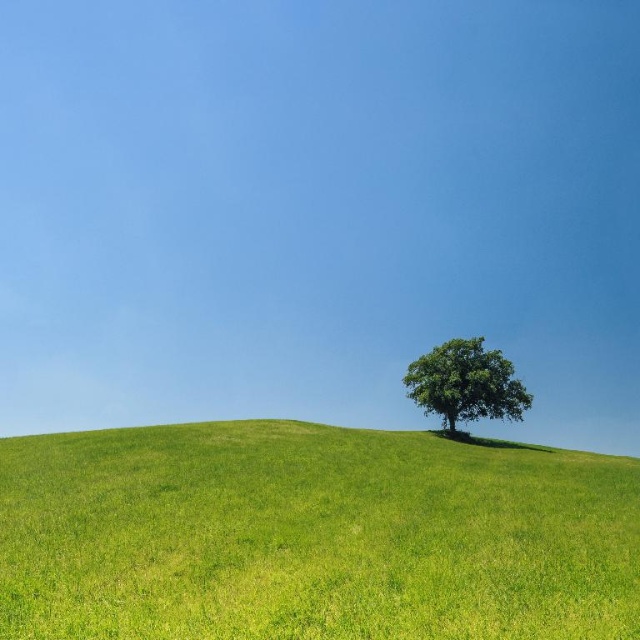
You are a hiker trying to cross the green grassy hillside at center and the green leafy tree at center. Which one has a larger width?

The green grassy hillside at center might be wider than green leafy tree at center according to the description.

You are standing on the green grassy hillside at center and want to look at the green leafy tree at center. In which direction should you look to see the tree?

The green grassy hillside at center is below the green leafy tree at center, so you should look upward to see the tree.

You are standing at the base of the green grassy hillside at center and want to walk to the green leafy tree at center. Which direction should you move to get closer to the tree?

To reach the green leafy tree at center, you should move forward up the green grassy hillside at center since the tree is further away from you than the hillside.